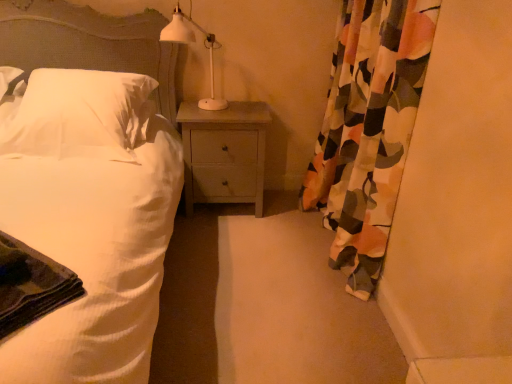
Question: Is dark green fabric at lower left taller or shorter than light wood nightstand at center?

Choices:
 (A) tall
 (B) short

Answer: (B)

Question: Choose the correct answer: Is dark green fabric at lower left inside light wood nightstand at center or outside it?

Choices:
 (A) outside
 (B) inside

Answer: (A)

Question: Which object is the farthest from the white soft pillow at left?

Choices:
 (A) light wood nightstand at center
 (B) dark green fabric at lower left
 (C) white textured bed at left
 (D) floral fabric curtain at right
 (E) white matte table lamp at upper center

Answer: (D)

Question: Estimate the real-world distances between objects in this image. Which object is closer to the white textured bed at left?

Choices:
 (A) white matte table lamp at upper center
 (B) dark green fabric at lower left
 (C) light wood nightstand at center
 (D) white soft pillow at left
 (E) floral fabric curtain at right

Answer: (D)